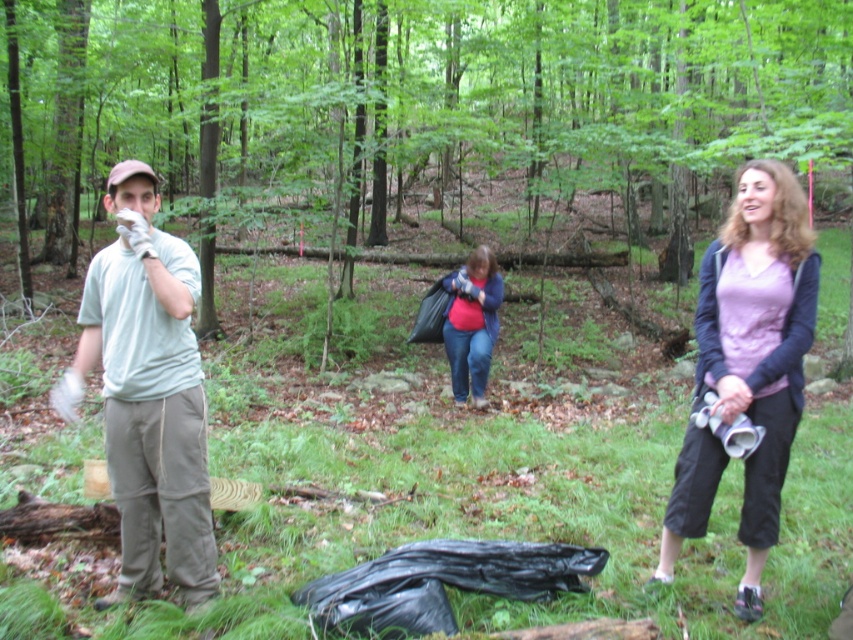
Question: Which of the following is the farthest from the observer?

Choices:
 (A) matte pink shirt at center
 (B) matte purple shirt at center
 (C) white cotton glove at left
 (D) green matte forest at center

Answer: (A)

Question: Which point appears farthest from the camera in this image?

Choices:
 (A) (650, 150)
 (B) (784, 189)

Answer: (A)

Question: Is white cotton glove at left positioned in front of matte pink shirt at center?

Choices:
 (A) yes
 (B) no

Answer: (A)

Question: Based on their relative distances, which object is farther from the green matte forest at center?

Choices:
 (A) white cotton glove at left
 (B) matte pink shirt at center
 (C) matte purple shirt at center

Answer: (C)

Question: Does green matte forest at center appear over matte pink shirt at center?

Choices:
 (A) no
 (B) yes

Answer: (B)

Question: Is green matte forest at center to the left of white cotton glove at left from the viewer's perspective?

Choices:
 (A) no
 (B) yes

Answer: (A)